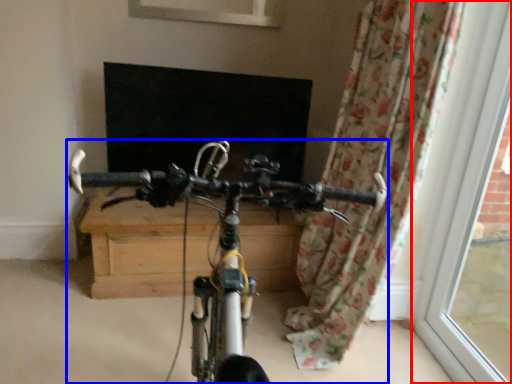
Question: Which of the following is the closest to the observer, window frame (highlighted by a red box) or bicycle (highlighted by a blue box)?

Choices:
 (A) window frame
 (B) bicycle

Answer: (B)